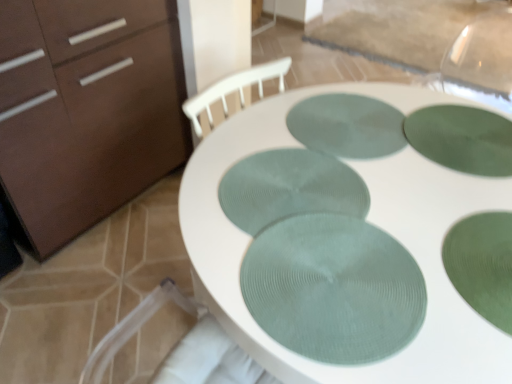
Identify the location of vacant point above green textured glass plate at upper right, positioned as the 4th glass plate in front-to-back order (from a real-world perspective). Image resolution: width=512 pixels, height=384 pixels. (463, 142).